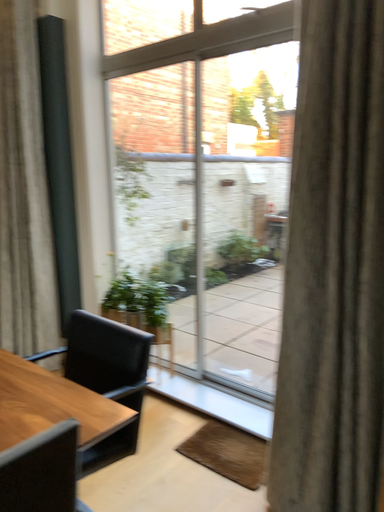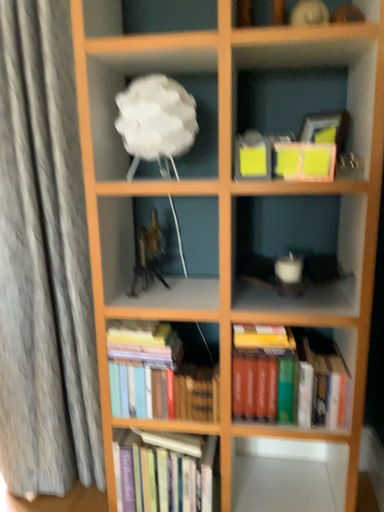
Question: How did the camera likely rotate when shooting the video?

Choices:
 (A) rotated right
 (B) rotated left

Answer: (A)